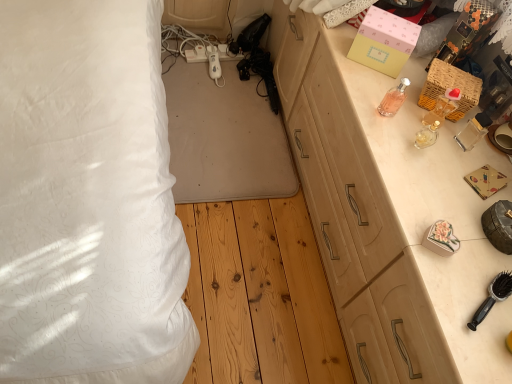
I want to click on vacant space in between black plastic brush at lower right and pink matte box at upper right, arranged as the 2th box when viewed from the right, so click(415, 162).